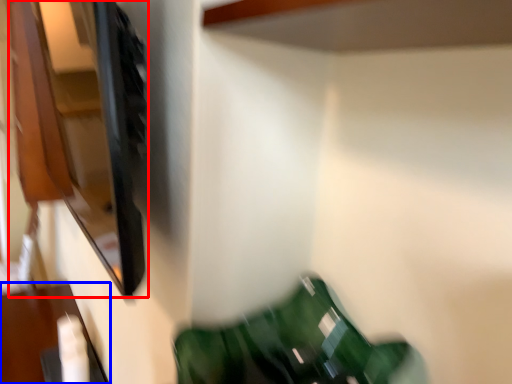
Question: Among these objects, which one is farthest to the camera, cabinet (highlighted by a red box) or furniture (highlighted by a blue box)?

Choices:
 (A) cabinet
 (B) furniture

Answer: (B)